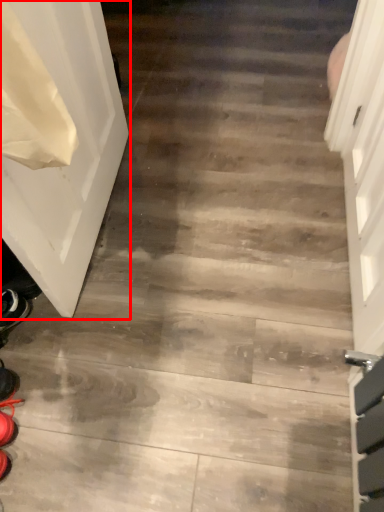
Question: In this image, where is door (annotated by the red box) located relative to shoe?

Choices:
 (A) right
 (B) left

Answer: (A)